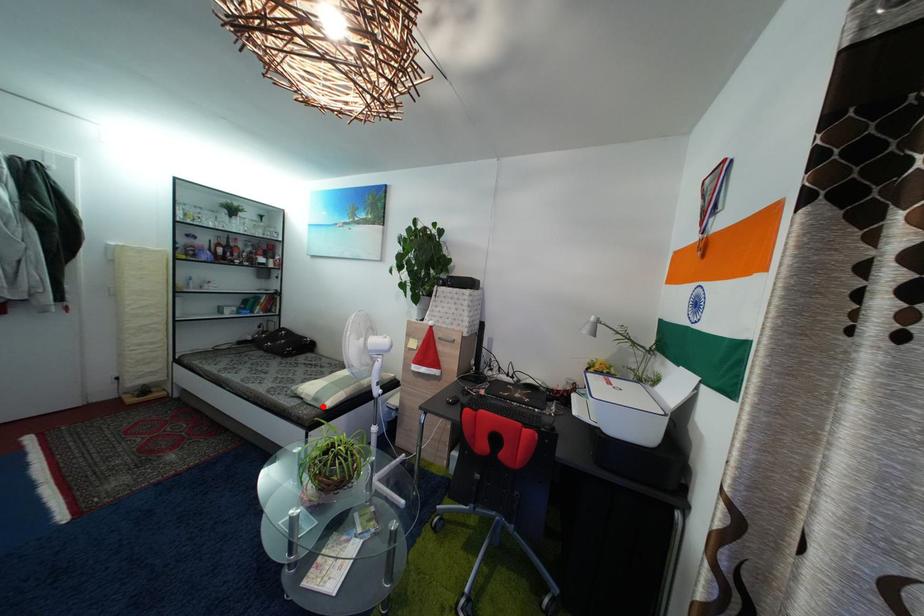
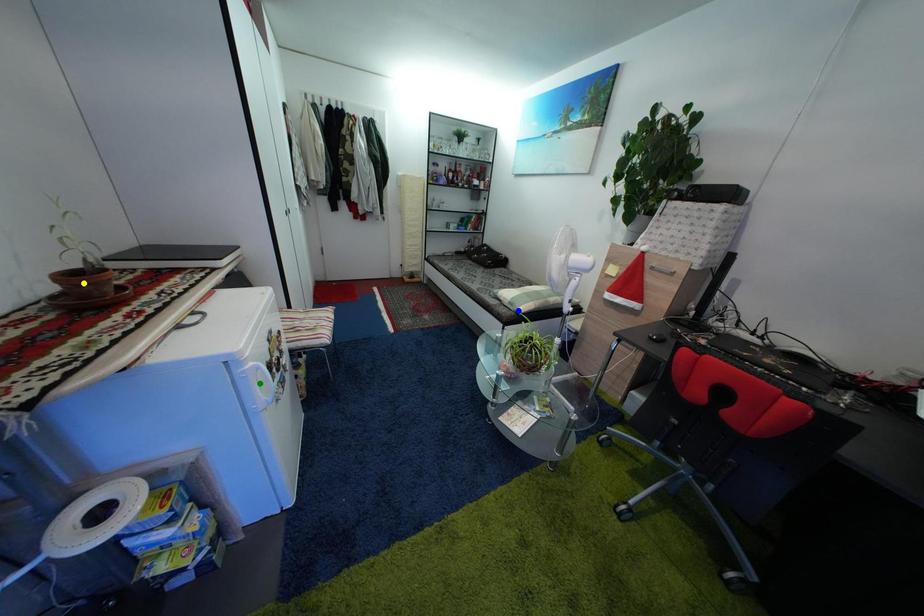
Question: I am providing you with two images of the same scene from different viewpoints. A red point is marked on the first image. You are given multiple points on the second image. Which spot in image 2 lines up with the point in image 1?

Choices:
 (A) blue point
 (B) green point
 (C) yellow point

Answer: (A)